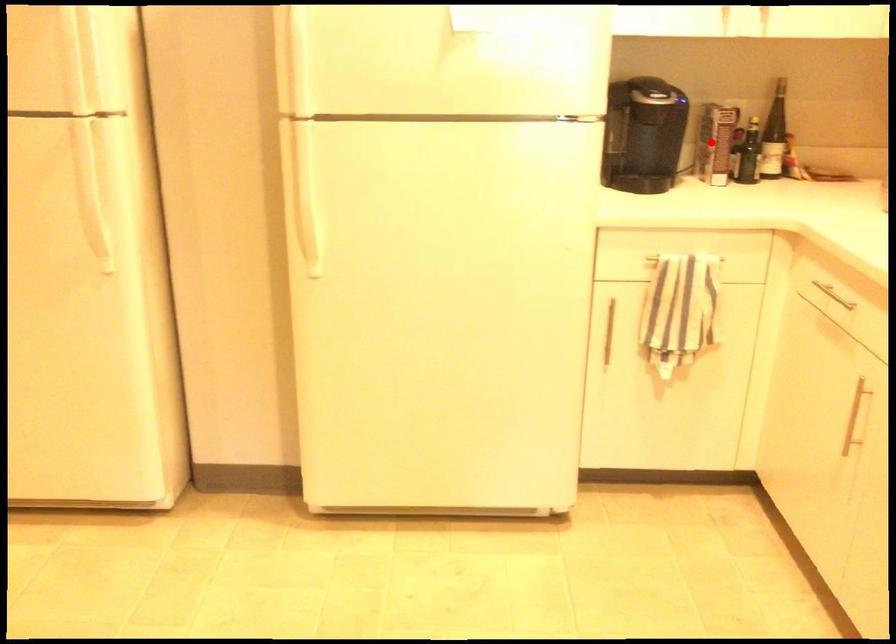
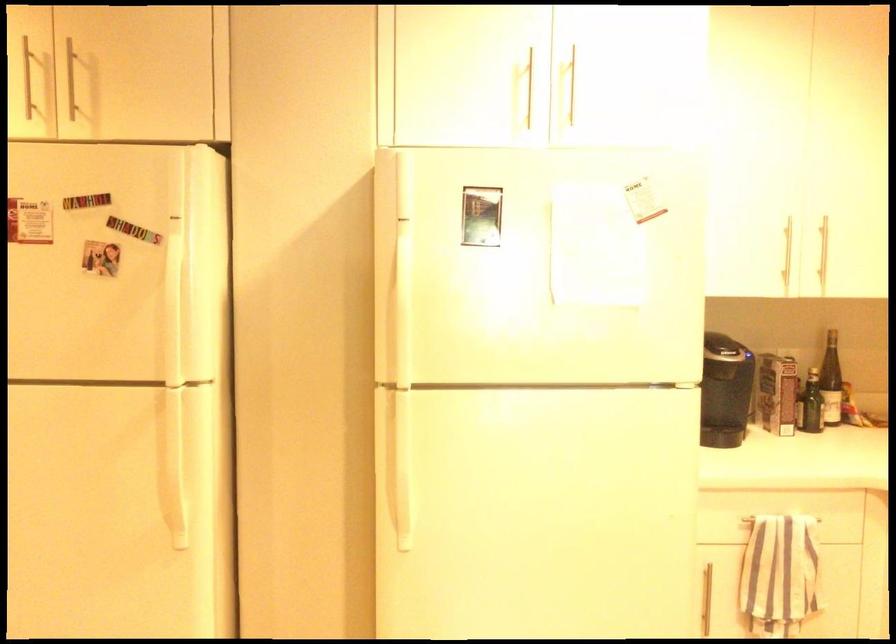
The point at the highlighted location is marked in the first image. Where is the corresponding point in the second image?

(777, 393)